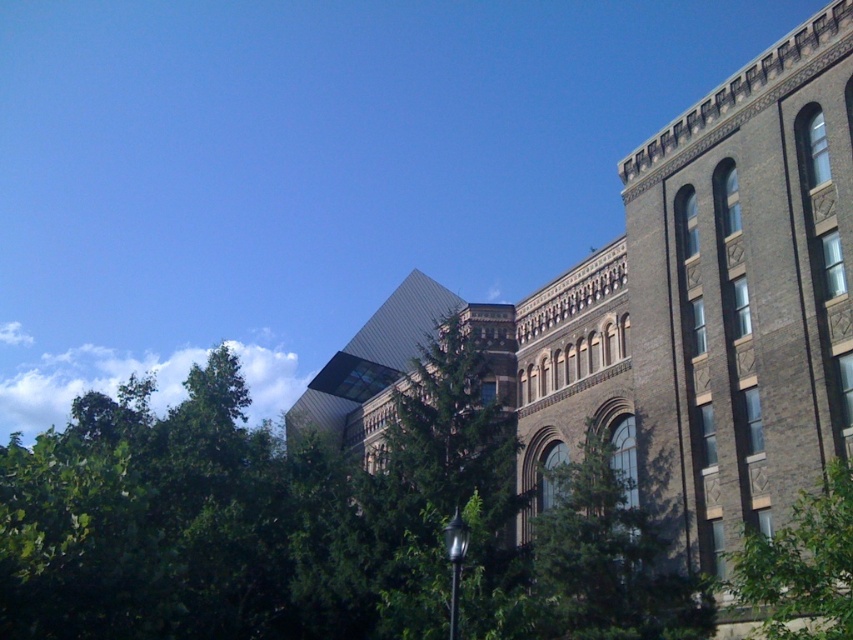
Is green leafy tree at center positioned at the back of green leafy tree at lower right?

Yes, green leafy tree at center is further from the viewer.

Is green leafy tree at center to the left of green leafy tree at lower right from the viewer's perspective?

Correct, you'll find green leafy tree at center to the left of green leafy tree at lower right.

What do you see at coordinates (608, 556) in the screenshot? The width and height of the screenshot is (853, 640). I see `green leafy tree at center` at bounding box center [608, 556].

Find the location of a particular element. The image size is (853, 640). green leafy tree at center is located at coordinates pos(608,556).